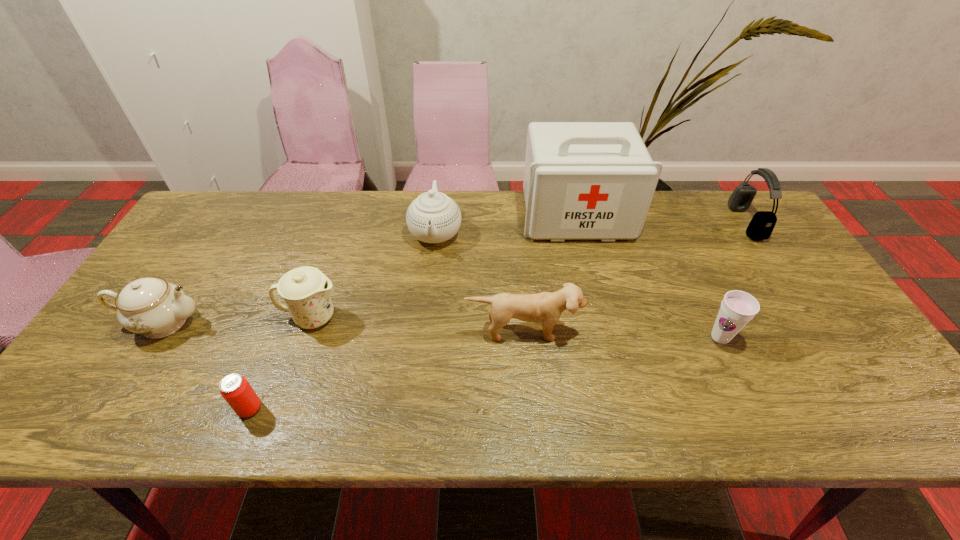
Locate an element on the screen. The width and height of the screenshot is (960, 540). the tallest object is located at coordinates (583, 180).

You are a GUI agent. You are given a task and a screenshot of the screen. Output one action in this format:
    pyautogui.click(x=<x>, y=<y>)
    Task: Click on the headset
    The height and width of the screenshot is (540, 960).
    Given the screenshot: What is the action you would take?
    762,224

Identify the location of the fifth object from right to left. (433, 217).

Identify the location of the rightmost chinaware. The height and width of the screenshot is (540, 960). (433, 217).

This screenshot has width=960, height=540. I want to click on the second chinaware from right to left, so click(305, 290).

The height and width of the screenshot is (540, 960). Find the location of `puppy`. puppy is located at coordinates (547, 307).

Find the location of a particular element. The width and height of the screenshot is (960, 540). the leftmost object is located at coordinates (152, 307).

What are the coordinates of `cup` in the screenshot? It's located at (737, 308).

Image resolution: width=960 pixels, height=540 pixels. In order to click on beer can in this screenshot , I will do `click(235, 389)`.

You are a GUI agent. You are given a task and a screenshot of the screen. Output one action in this format:
    pyautogui.click(x=<x>, y=<y>)
    Task: Click on the shortest object
    The image size is (960, 540).
    Given the screenshot: What is the action you would take?
    pyautogui.click(x=235, y=389)